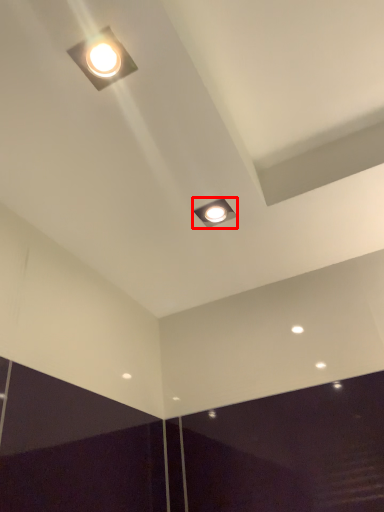
Question: From the image's perspective, what is the correct spatial positioning of lamp (annotated by the red box) in reference to lamp?

Choices:
 (A) above
 (B) below

Answer: (B)